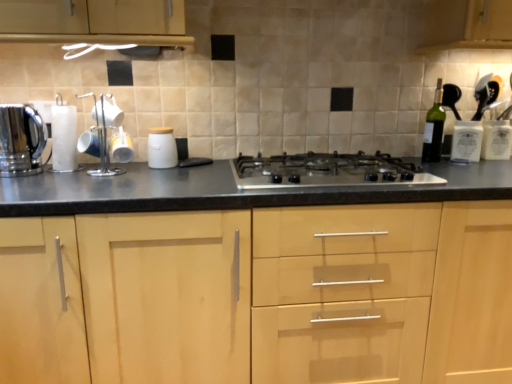
Question: Is point (165, 135) closer or farther from the camera than point (377, 309)?

Choices:
 (A) closer
 (B) farther

Answer: (B)

Question: Visually, is white matte jar at center, the second kitchen appliance when ordered from left to right, positioned to the left or to the right of light wood cabinet at center?

Choices:
 (A) left
 (B) right

Answer: (A)

Question: Estimate the real-world distances between objects in this image. Which object is closer to the white matte jar at center, acting as the first kitchen appliance starting from the right?

Choices:
 (A) green glass bottle at right
 (B) satin silver gas stove at center
 (C) metallic cup rack at left
 (D) polished stainless steel kettle at left, the 1th kitchen appliance from the left
 (E) light wood cabinet at center

Answer: (C)

Question: Which object is positioned farthest from the white matte jar at center, the second kitchen appliance when ordered from left to right?

Choices:
 (A) polished stainless steel kettle at left, which is the 2th kitchen appliance from right to left
 (B) green glass bottle at right
 (C) metallic cup rack at left
 (D) light wood cabinet at center
 (E) satin silver gas stove at center

Answer: (B)